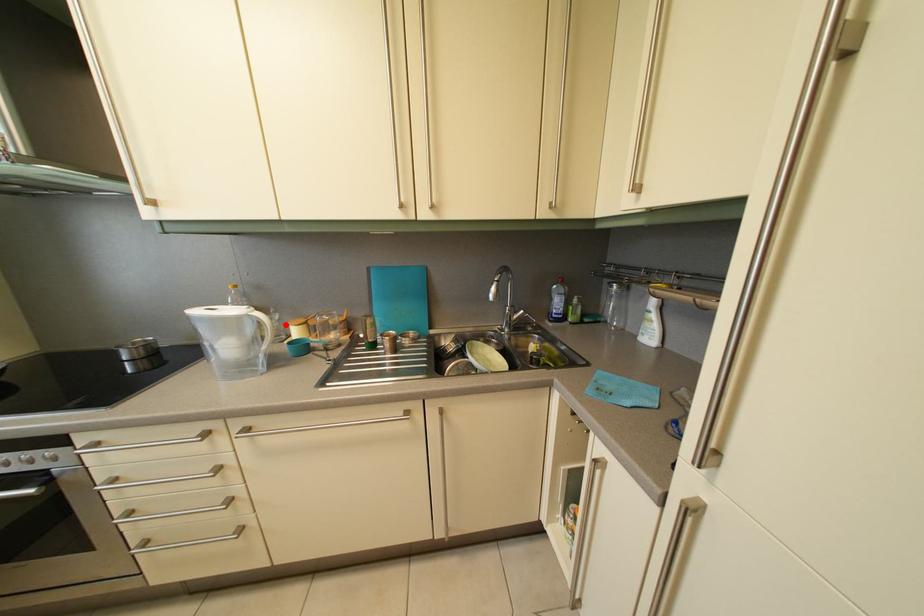
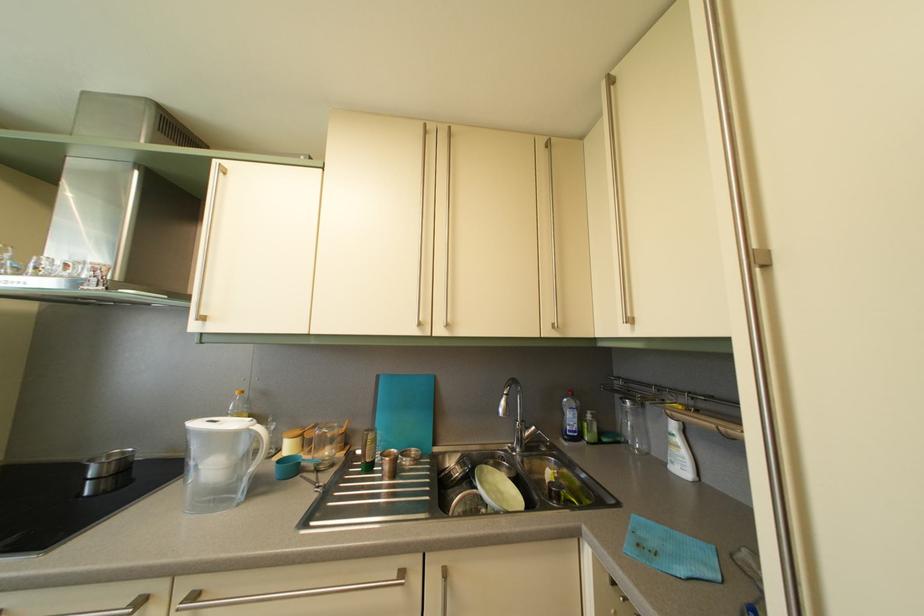
The point at the highlighted location is marked in the first image. Where is the corresponding point in the second image?

(282, 435)